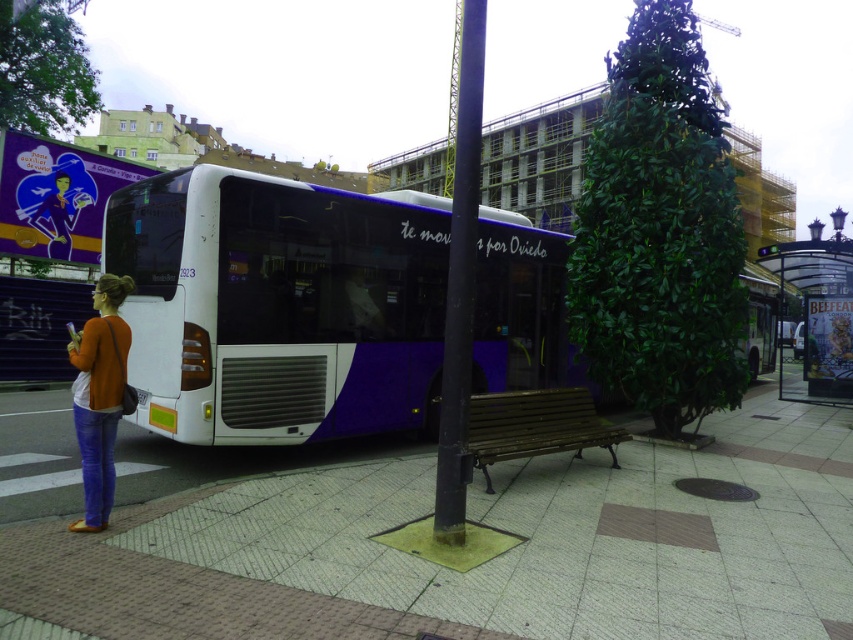
Which is in front, point (718, 538) or point (96, 516)?

Positioned in front is point (96, 516).

Is point (502, 465) farther from camera compared to point (91, 509)?

Yes, it is.

Which is behind, point (310, 496) or point (86, 468)?

The point (310, 496) is behind.

You are a GUI agent. You are given a task and a screenshot of the screen. Output one action in this format:
    pyautogui.click(x=<x>, y=<y>)
    Task: Click on the smooth concrete bench at center
    The height and width of the screenshot is (640, 853).
    Given the screenshot: What is the action you would take?
    pyautogui.click(x=440, y=564)

Does point (109, 365) come behind point (572, 429)?

No, it is not.

Between point (91, 499) and point (474, 464), which one is positioned behind?

Positioned behind is point (474, 464).

Does point (90, 451) come in front of point (538, 390)?

Yes, it is in front of point (538, 390).

Where is `orange sweater at left`? The width and height of the screenshot is (853, 640). orange sweater at left is located at coordinates (99, 396).

Is white matte bus at center to the right of wooden bench at center from the viewer's perspective?

Correct, you'll find white matte bus at center to the right of wooden bench at center.

Between point (231, 378) and point (596, 432), which one is positioned behind?

The point (596, 432) is behind.

Identify the location of white matte bus at center. This screenshot has height=640, width=853. (279, 305).